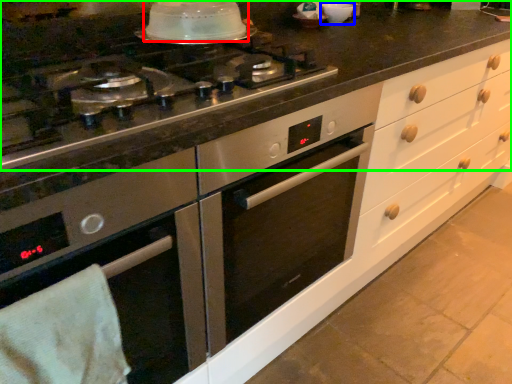
Question: Which object is the closest to the kitchen appliance (highlighted by a red box)? Choose among these: appliance (highlighted by a blue box) or countertop (highlighted by a green box).

Choices:
 (A) appliance
 (B) countertop

Answer: (B)